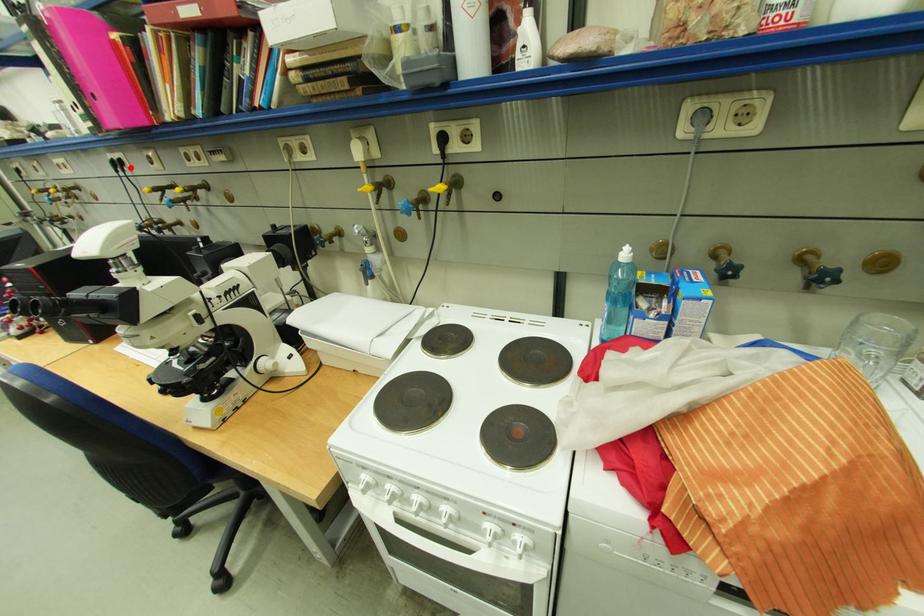
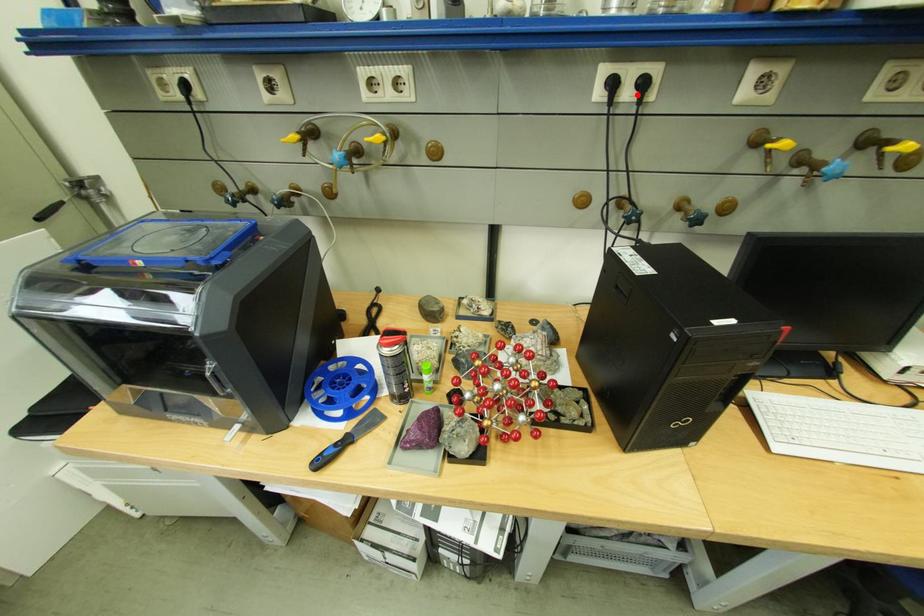
I am providing you with two images of the same scene from different viewpoints. A red point is marked on the first image and another point is marked on the second image. Does the point marked in image1 correspond to the same location as the one in image2?

Yes